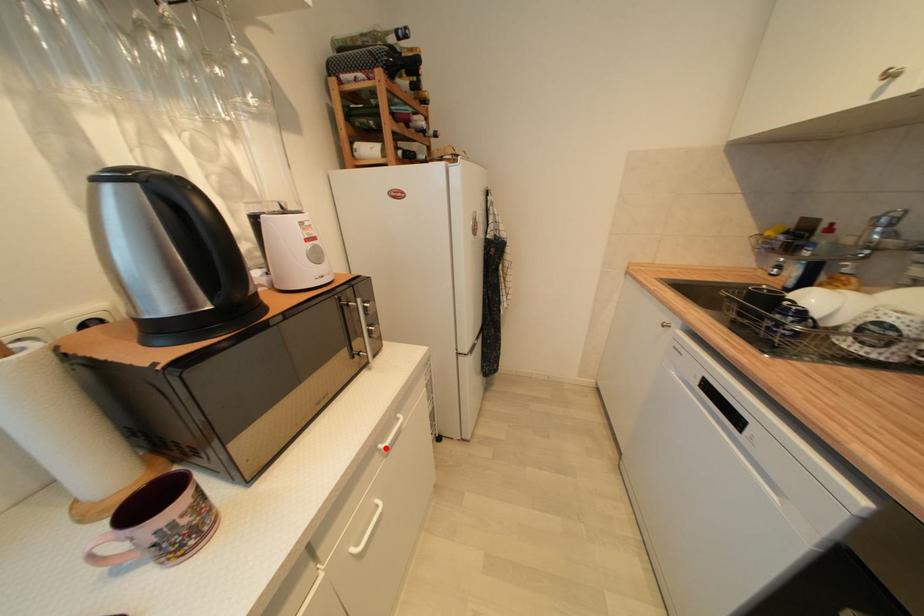
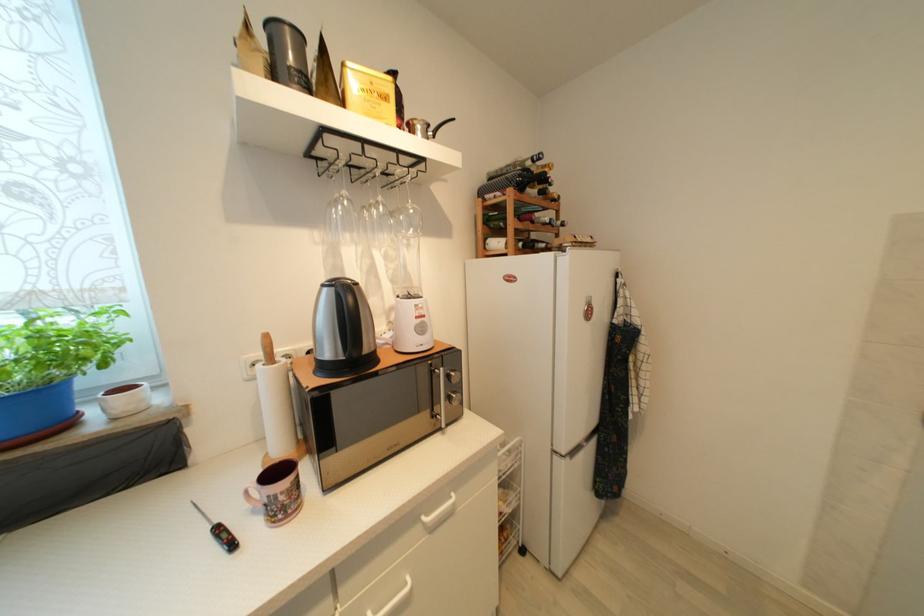
Question: I am providing you with two images of the same scene from different viewpoints. A red point is shown in image1. For the corresponding object point in image2, is it positioned nearer or farther from the camera?

Choices:
 (A) Nearer
 (B) Farther

Answer: (B)